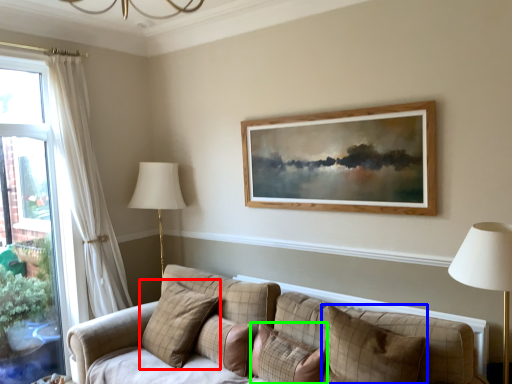
Question: Which object is positioned farthest from pillow (highlighted by a red box)? Select from pillow (highlighted by a blue box) and pillow (highlighted by a green box).

Choices:
 (A) pillow
 (B) pillow

Answer: (A)